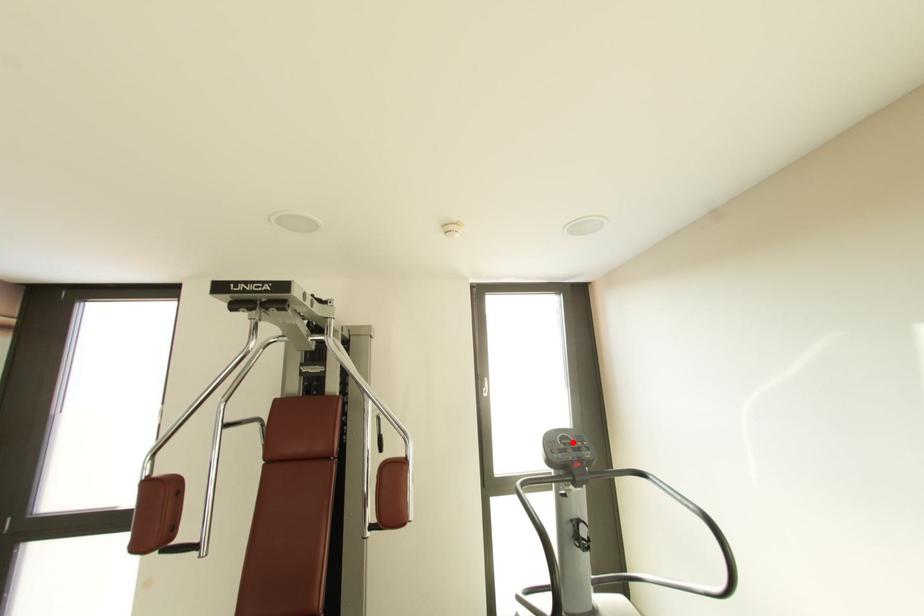
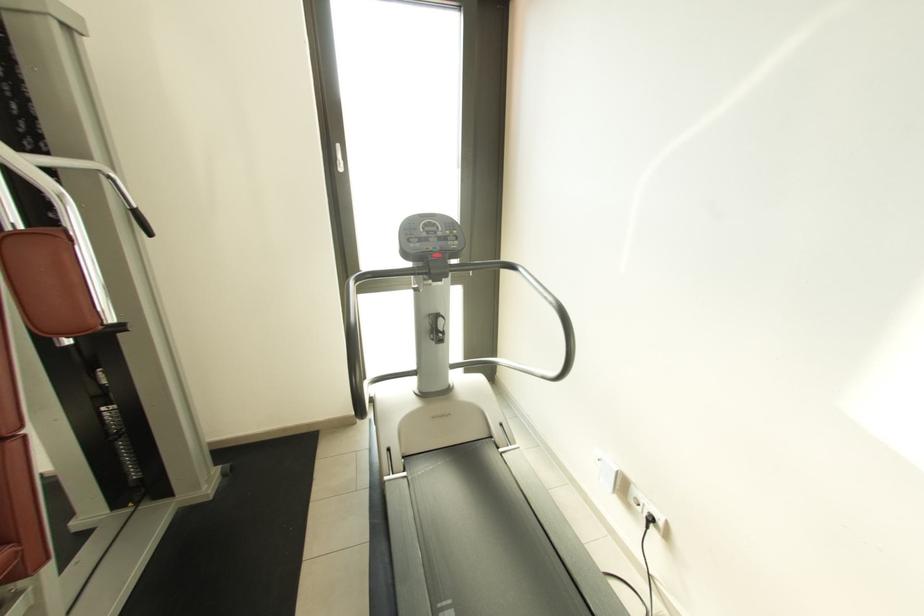
The point at the highlighted location is marked in the first image. Where is the corresponding point in the second image?

(439, 230)